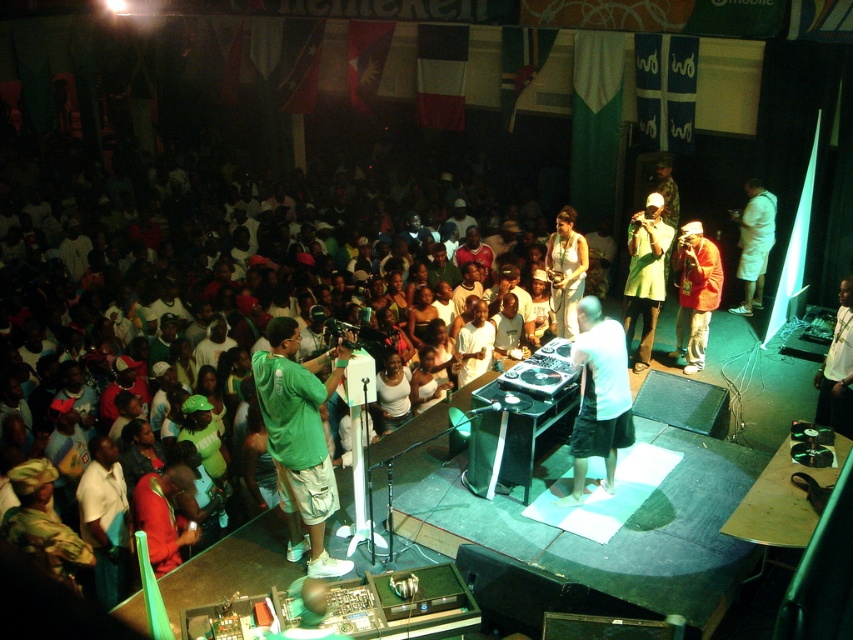
You are standing at the DJ booth and see a point marked at point (299, 440). Which object is this point located on?

The point (299, 440) is located on the green matte shirt at lower left.

You are a performer standing at the DJ booth. You need to hand a microphone to the person in the green matte shirt at lower left, but you have to avoid the white cotton crowd at lower left. Is the distance between them sufficient for you to reach the person without getting too close to the crowd?

The distance between the white cotton crowd at lower left and the green matte shirt at lower left is 3.86 meters. Since the performer is at the DJ booth, they can likely extend their arm or use a longer microphone to reach the person without needing to get closer than 3.86 meters to the crowd.

You are at the concert venue and want to move from the DJ booth to the stage lights. You see two points marked in the image. Which point is closer to you, point (144, 416) or point (347, 356)?

Point (144, 416) is closer to you because it is further to the viewer than point (347, 356).